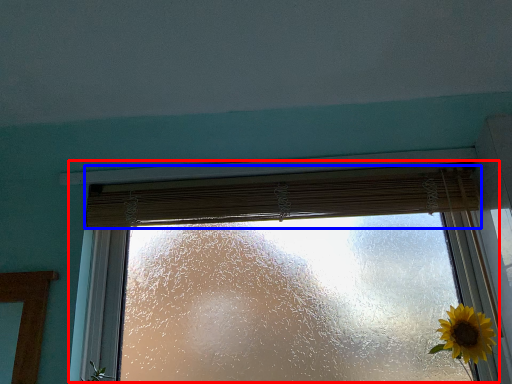
Question: Which point is closer to the camera, window (highlighted by a red box) or curtain (highlighted by a blue box)?

Choices:
 (A) window
 (B) curtain

Answer: (A)